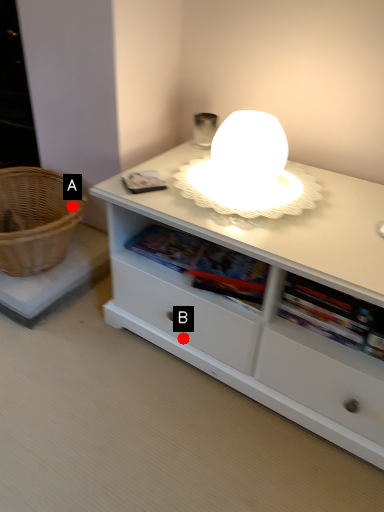
Question: Two points are circled on the image, labeled by A and B beside each circle. Which point appears closest to the camera in this image?

Choices:
 (A) A is closer
 (B) B is closer

Answer: (B)